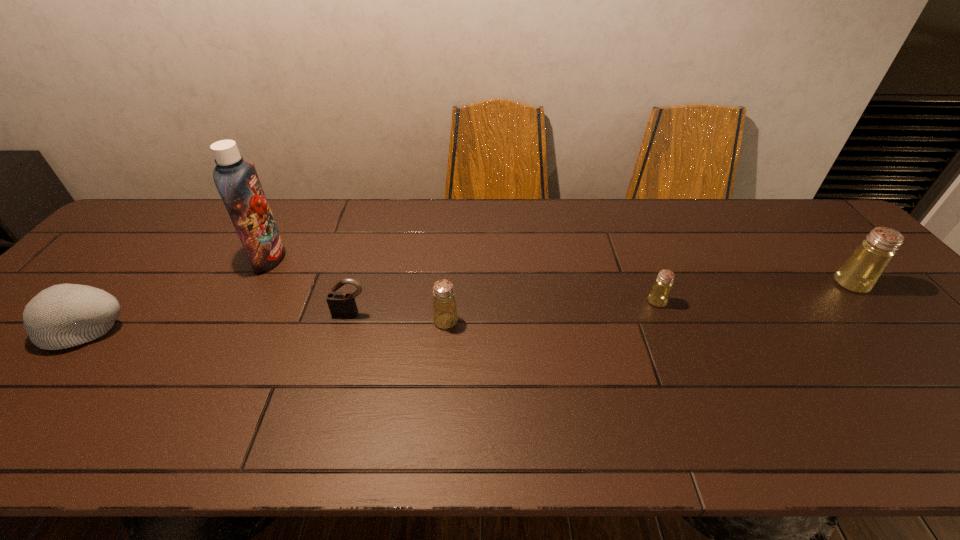
You are a GUI agent. You are given a task and a screenshot of the screen. Output one action in this format:
    pyautogui.click(x=<x>, y=<y>)
    Task: Click on the fourth object from left to right
    
    Given the screenshot: What is the action you would take?
    pyautogui.click(x=445, y=315)

Locate an element on the screen. the leftmost saltshaker is located at coordinates 445,315.

Where is `the second object from right to left`? The height and width of the screenshot is (540, 960). the second object from right to left is located at coordinates [x=659, y=295].

Locate an element on the screen. the shortest saltshaker is located at coordinates (659, 295).

Where is `the rightmost object`? The height and width of the screenshot is (540, 960). the rightmost object is located at coordinates (860, 272).

This screenshot has height=540, width=960. I want to click on the tallest saltshaker, so click(x=860, y=272).

Find the location of `the leftmost object`. the leftmost object is located at coordinates (65, 315).

Where is `padlock`? The image size is (960, 540). padlock is located at coordinates (341, 304).

At what (x,y) coordinates should I click in order to perform the action: click on the tallest object. Please return your answer as a coordinate pair (x, y). The image size is (960, 540). Looking at the image, I should click on (237, 182).

The image size is (960, 540). In order to click on the second object from left to right in this screenshot , I will do `click(237, 182)`.